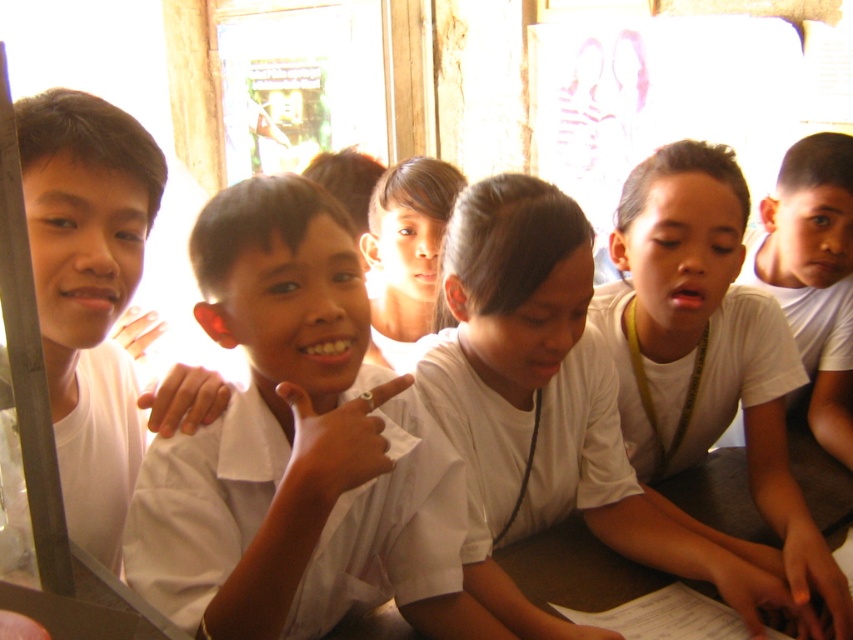
How much distance is there between white matte shirt at center and white matte shirt at right?

white matte shirt at center is 14.83 inches away from white matte shirt at right.

Between white matte shirt at center and white matte shirt at right, which one is positioned lower?

white matte shirt at center

Which is in front, point (709, 276) or point (815, 376)?

Point (709, 276) is more forward.

The height and width of the screenshot is (640, 853). What are the coordinates of `white matte shirt at center` in the screenshot? It's located at (708, 358).

Does white matte shirt at left have a greater width compared to smooth skin face at center?

No, white matte shirt at left is not wider than smooth skin face at center.

Between white matte shirt at left and smooth skin face at center, which one is positioned lower?

white matte shirt at left is below.

Is point (45, 296) in front of point (418, 232)?

Yes, it is in front of point (418, 232).

At what (x,y) coordinates should I click in order to perform the action: click on white matte shirt at left. Please return your answer as a coordinate pair (x, y). Image resolution: width=853 pixels, height=640 pixels. Looking at the image, I should click on (88, 292).

Can you confirm if white matte shirt at center is taller than white matte shirt at left?

Indeed, white matte shirt at center has a greater height compared to white matte shirt at left.

Who is shorter, white matte shirt at center or white matte shirt at left?

With less height is white matte shirt at left.

Image resolution: width=853 pixels, height=640 pixels. Find the location of `white matte shirt at center`. white matte shirt at center is located at coordinates (708, 358).